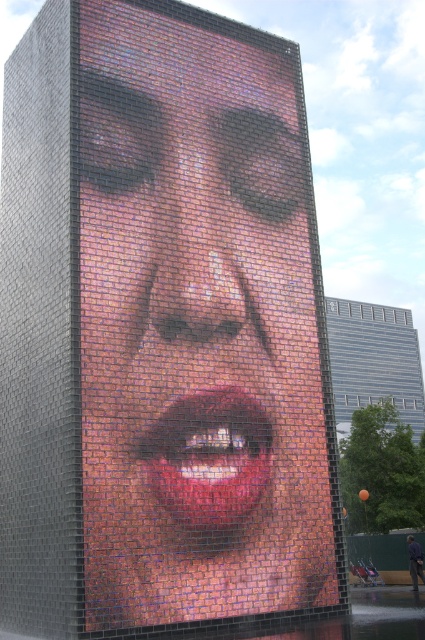
Measure the distance from shiny metallic face at center to shiny pink lips at center.

shiny metallic face at center and shiny pink lips at center are 36.15 inches apart.

Can you confirm if shiny metallic face at center is smaller than shiny pink lips at center?

No, shiny metallic face at center is not smaller than shiny pink lips at center.

The height and width of the screenshot is (640, 425). What are the coordinates of `shiny metallic face at center` in the screenshot? It's located at (200, 324).